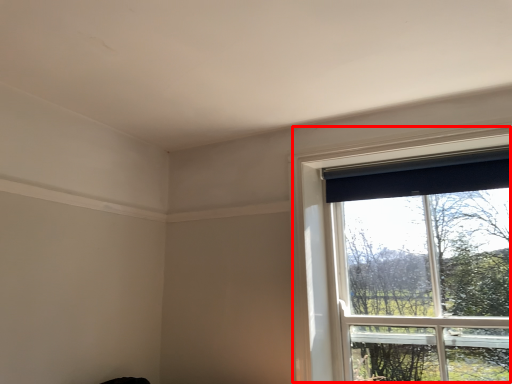
Question: Where is window (annotated by the red box) located in relation to curtain in the image?

Choices:
 (A) right
 (B) left

Answer: (A)